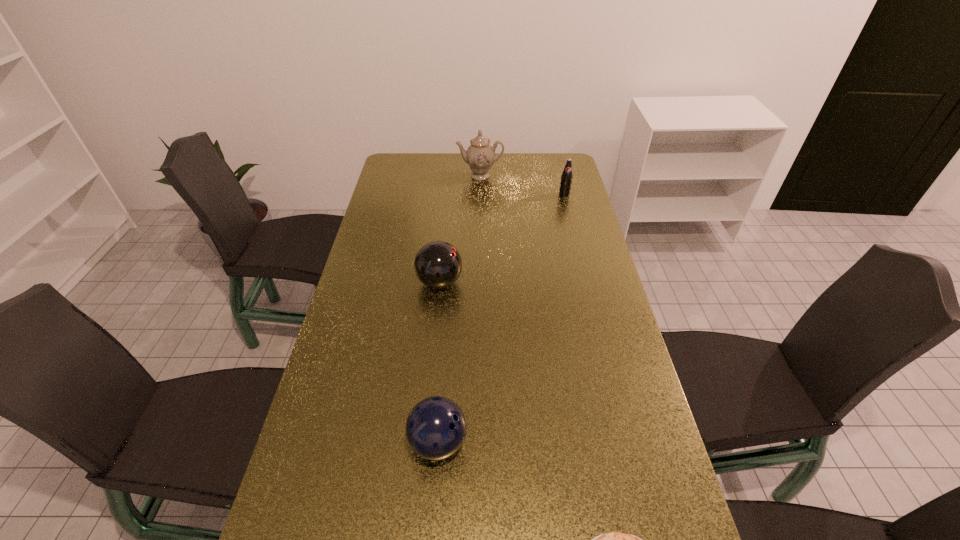
The image size is (960, 540). I want to click on object that is at the right edge, so click(x=566, y=178).

In order to click on free space at the far edge of the desktop in this screenshot , I will do `click(536, 180)`.

Find the location of a particular element. This screenshot has height=540, width=960. vacant space at the left edge of the desktop is located at coordinates (326, 408).

I want to click on free location at the right edge, so click(595, 454).

Where is `vacant area at the far left corner of the desktop`? This screenshot has width=960, height=540. vacant area at the far left corner of the desktop is located at coordinates (399, 177).

Find the location of a particular element. free space at the far right corner of the desktop is located at coordinates (534, 157).

The image size is (960, 540). In order to click on free space between the third farthest object and the tallest object in this screenshot , I will do `click(460, 229)`.

This screenshot has height=540, width=960. What are the coordinates of `empty space that is in between the farthest object and the third nearest object` in the screenshot? It's located at (460, 229).

Locate an element on the screen. The height and width of the screenshot is (540, 960). vacant space in between the pop and the tallest object is located at coordinates (522, 185).

Where is `vacant space that is in between the third nearest object and the pop`? This screenshot has height=540, width=960. vacant space that is in between the third nearest object and the pop is located at coordinates (502, 238).